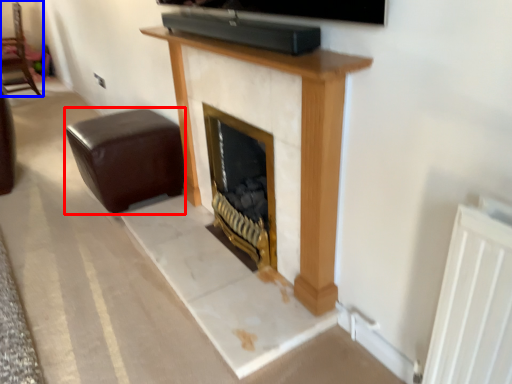
Question: Which object appears closest to the camera in this image, furniture (highlighted by a red box) or furniture (highlighted by a blue box)?

Choices:
 (A) furniture
 (B) furniture

Answer: (A)